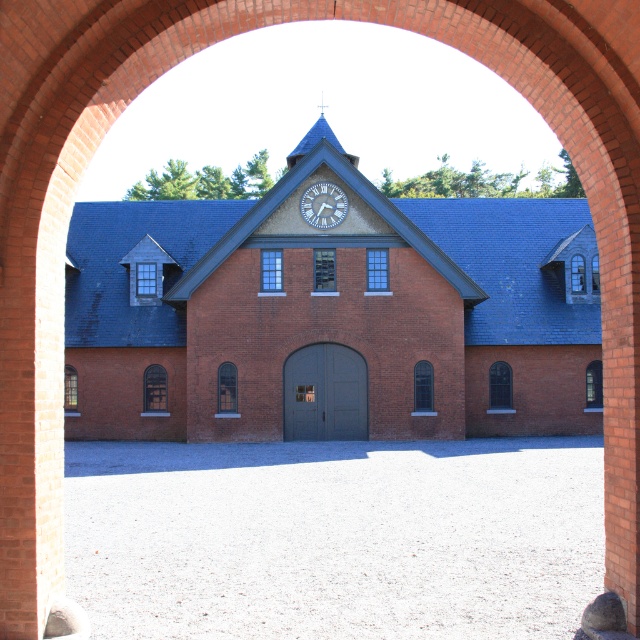
Can you confirm if brick building at center is shorter than white textured clock at upper center?

No, brick building at center is not shorter than white textured clock at upper center.

Image resolution: width=640 pixels, height=640 pixels. What are the coordinates of `brick building at center` in the screenshot? It's located at (332, 314).